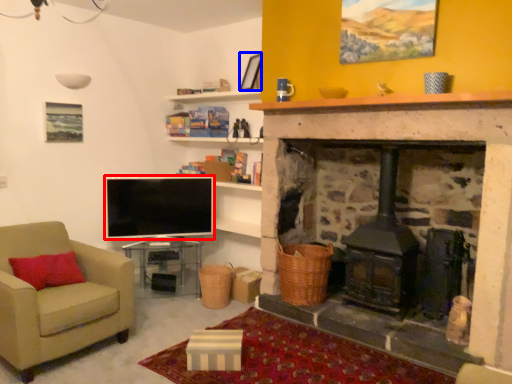
Question: Which object appears closest to the camera in this image, television (highlighted by a red box) or picture frame (highlighted by a blue box)?

Choices:
 (A) television
 (B) picture frame

Answer: (B)